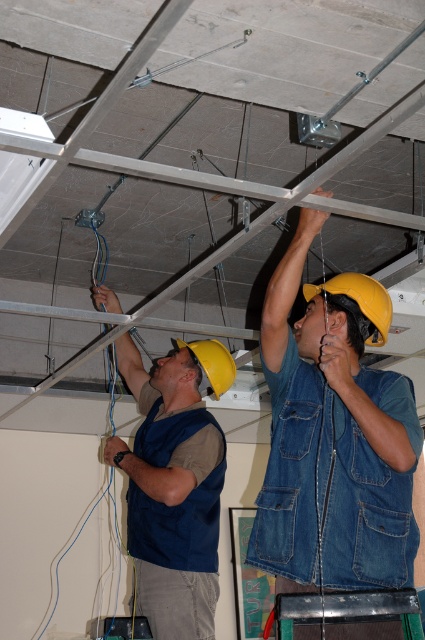
Question: Which of the following is the farthest from the observer?

Choices:
 (A) (380, 337)
 (B) (155, 381)

Answer: (B)

Question: Considering the real-world distances, which object is farthest from the yellow hard hat at upper center?

Choices:
 (A) blue denim vest at center
 (B) denim vest at upper center

Answer: (A)

Question: In this image, where is blue denim vest at center located relative to yellow matte helmet at center?

Choices:
 (A) left
 (B) right

Answer: (A)

Question: Among these objects, which one is nearest to the camera?

Choices:
 (A) denim vest at upper center
 (B) yellow hard hat at upper center
 (C) yellow matte helmet at center
 (D) blue denim vest at center

Answer: (A)

Question: Can you confirm if blue denim vest at center is bigger than yellow hard hat at upper center?

Choices:
 (A) yes
 (B) no

Answer: (A)

Question: From the image, what is the correct spatial relationship of blue denim vest at center in relation to yellow matte helmet at center?

Choices:
 (A) right
 (B) left

Answer: (B)